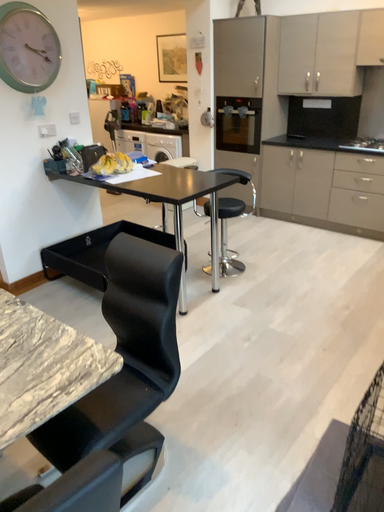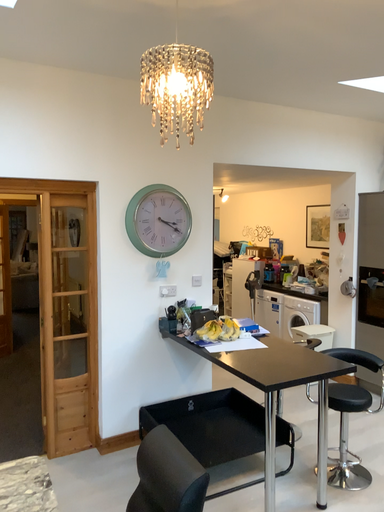
Question: Which way did the camera rotate in the video?

Choices:
 (A) rotated right
 (B) rotated left

Answer: (B)